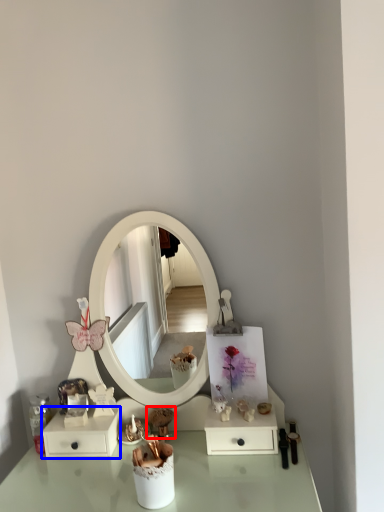
Question: Which object appears closest to the camera in this image, toy (highlighted by a red box) or dresser (highlighted by a blue box)?

Choices:
 (A) toy
 (B) dresser

Answer: (B)